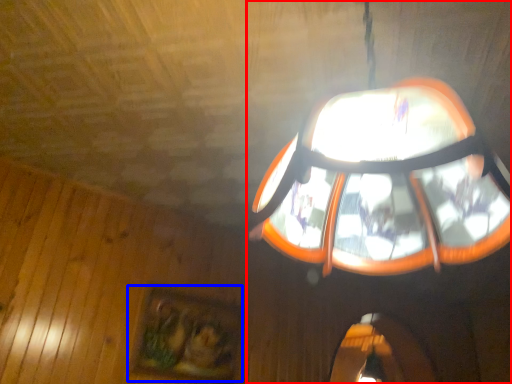
Question: Which object appears farthest to the camera in this image, lamp (highlighted by a red box) or picture frame (highlighted by a blue box)?

Choices:
 (A) lamp
 (B) picture frame

Answer: (B)